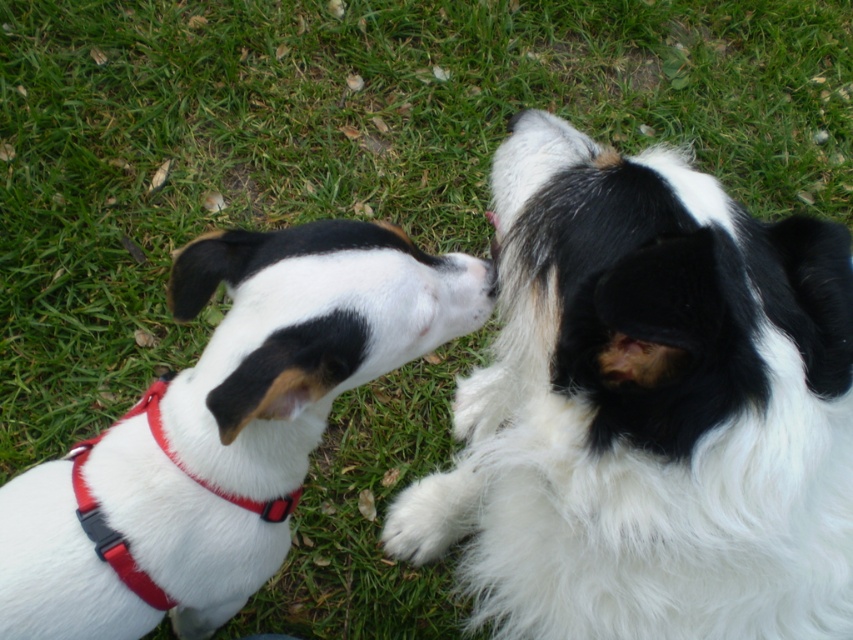
You are a photographer trying to capture a photo of both the white fluffy dog at upper center and the white fur dog at center. Based on their positions, which dog should you focus on first to ensure both are in frame?

You should focus on the white fluffy dog at upper center first because it is positioned above the white fur dog at center, so adjusting the camera angle to include both would require framing from the top down.

You are standing in front of the two dogs and want to take a photo. You notice two specific points on the dogs. One is at point (x=608, y=232) and the other at point (x=192, y=243). Which point will appear larger in your photo?

Point (x=608, y=232) will appear larger in the photo because it is closer to the camera than point (x=192, y=243).

You are a photographer trying to capture a photo of the white fluffy dog at upper center and the red fabric neckband at lower left. If you want to ensure both subjects are in focus, which one should you adjust your camera focus on first?

The white fluffy dog at upper center is wider than the red fabric neckband at lower left, so you should focus on the wider subject first to ensure depth of field covers both.